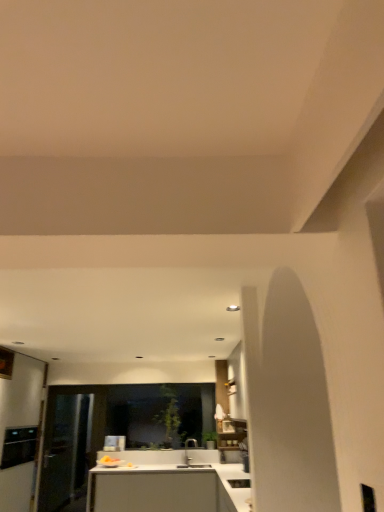
What do you see at coordinates (169, 489) in the screenshot? The height and width of the screenshot is (512, 384). I see `white glossy countertop at center` at bounding box center [169, 489].

The image size is (384, 512). Identify the location of transparent glass door at left. (65, 450).

Where is `black stainless steel oven at left, placed as the second appliance when sorted from right to left`? This screenshot has height=512, width=384. black stainless steel oven at left, placed as the second appliance when sorted from right to left is located at coordinates (19, 446).

Locate an element on the screen. This screenshot has width=384, height=512. white glossy sink at lower center, which appears as the second appliance when viewed from the back is located at coordinates (239, 483).

From the image's perspective, is matte silver faucet at center on top of white glossy sink at lower center, which is the second appliance in left-to-right order?

Incorrect, from the image's perspective, matte silver faucet at center is lower than white glossy sink at lower center, which is the second appliance in left-to-right order.

Are matte silver faucet at center and white glossy sink at lower center, which is the 1th appliance in front-to-back order, beside each other?

There is a gap between matte silver faucet at center and white glossy sink at lower center, which is the 1th appliance in front-to-back order.

Does matte silver faucet at center turn towards white glossy sink at lower center, arranged as the 1th appliance when viewed from the right?

No, matte silver faucet at center does not turn towards white glossy sink at lower center, arranged as the 1th appliance when viewed from the right.

Does matte silver faucet at center have a lesser width compared to white glossy sink at lower center, arranged as the 1th appliance when viewed from the right?

Yes, matte silver faucet at center is thinner than white glossy sink at lower center, arranged as the 1th appliance when viewed from the right.

Is transparent glass door at left outside of black stainless steel oven at left, which is the first appliance in back-to-front order?

Indeed, transparent glass door at left is completely outside black stainless steel oven at left, which is the first appliance in back-to-front order.

This screenshot has height=512, width=384. What are the coordinates of `glass door that is under the black stainless steel oven at left, placed as the second appliance when sorted from right to left (from a real-world perspective)` in the screenshot? It's located at 65,450.

From the image's perspective, would you say transparent glass door at left is shown under black stainless steel oven at left, which is the first appliance in back-to-front order?

Yes, from the image's perspective, transparent glass door at left is beneath black stainless steel oven at left, which is the first appliance in back-to-front order.

Where is `glass door located behind the matte silver faucet at center`? glass door located behind the matte silver faucet at center is located at coordinates (65, 450).

Considering the positions of objects transparent glass door at left and matte silver faucet at center in the image provided, who is behind, transparent glass door at left or matte silver faucet at center?

transparent glass door at left is further away from the camera.

Based on the photo, how different are the orientations of transparent glass door at left and matte silver faucet at center in degrees?

The facing directions of transparent glass door at left and matte silver faucet at center are 45 degrees apart.

Is transparent glass door at left inside the boundaries of matte silver faucet at center, or outside?

transparent glass door at left is outside matte silver faucet at center.

Considering the positions of objects white glossy countertop at center and transparent glass door at left in the image provided, who is more to the right, white glossy countertop at center or transparent glass door at left?

From the viewer's perspective, white glossy countertop at center appears more on the right side.

Are white glossy countertop at center and transparent glass door at left located far from each other?

white glossy countertop at center is positioned a significant distance from transparent glass door at left.

This screenshot has height=512, width=384. I want to click on countertop located in front of the transparent glass door at left, so point(169,489).

Considering their positions, is white glossy countertop at center located in front of or behind matte silver faucet at center?

white glossy countertop at center is in front of matte silver faucet at center.

Who is smaller, white glossy countertop at center or matte silver faucet at center?

With smaller size is matte silver faucet at center.

Considering the sizes of objects white glossy countertop at center and matte silver faucet at center in the image provided, who is thinner, white glossy countertop at center or matte silver faucet at center?

matte silver faucet at center.

Which is more to the left, white glossy countertop at center or matte silver faucet at center?

From the viewer's perspective, white glossy countertop at center appears more on the left side.

Considering the sizes of matte silver faucet at center and white glossy countertop at center in the image, is matte silver faucet at center bigger or smaller than white glossy countertop at center?

In the image, matte silver faucet at center appears to be smaller than white glossy countertop at center.

From a real-world perspective, is matte silver faucet at center positioned over white glossy countertop at center based on gravity?

Yes.

Based on the photo, considering the sizes of objects matte silver faucet at center and white glossy countertop at center in the image provided, who is wider, matte silver faucet at center or white glossy countertop at center?

With larger width is white glossy countertop at center.

Which of these two, white glossy countertop at center or black stainless steel oven at left, acting as the 1th appliance starting from the left, is bigger?

white glossy countertop at center is bigger.

Would you say black stainless steel oven at left, placed as the second appliance when sorted from right to left, is part of white glossy countertop at center's contents?

No, black stainless steel oven at left, placed as the second appliance when sorted from right to left, is located outside of white glossy countertop at center.

In the scene shown: From the image's perspective, is white glossy countertop at center located beneath black stainless steel oven at left, which is the first appliance in back-to-front order?

Correct, white glossy countertop at center appears lower than black stainless steel oven at left, which is the first appliance in back-to-front order, in the image.

Which of these two, white glossy countertop at center or black stainless steel oven at left, which is the first appliance in back-to-front order, is wider?

Wider between the two is white glossy countertop at center.

The image size is (384, 512). I want to click on tap positioned vertically above the white glossy sink at lower center, which is the second appliance in left-to-right order (from a real-world perspective), so click(x=187, y=449).

Locate an element on the screen. glass door lying on the right of black stainless steel oven at left, acting as the 1th appliance starting from the left is located at coordinates (65, 450).

From the image, which object appears to be nearer to black stainless steel oven at left, the second appliance when ordered from front to back, matte silver faucet at center or transparent glass door at left?

The object closer to black stainless steel oven at left, the second appliance when ordered from front to back, is transparent glass door at left.

Looking at this image, which object lies nearer to the anchor point matte silver faucet at center, black stainless steel oven at left, which is the first appliance in back-to-front order, or white glossy sink at lower center, which is the second appliance in left-to-right order?

white glossy sink at lower center, which is the second appliance in left-to-right order.

When comparing their distances from matte silver faucet at center, does white glossy sink at lower center, arranged as the 1th appliance when viewed from the right, or black stainless steel oven at left, the second appliance when ordered from front to back, seem closer?

Based on the image, white glossy sink at lower center, arranged as the 1th appliance when viewed from the right, appears to be nearer to matte silver faucet at center.

Looking at the image, which one is located closer to transparent glass door at left, white glossy countertop at center or black stainless steel oven at left, the second appliance when ordered from front to back?

Among the two, black stainless steel oven at left, the second appliance when ordered from front to back, is located nearer to transparent glass door at left.

Based on their spatial positions, is white glossy sink at lower center, which appears as the second appliance when viewed from the back, or white glossy countertop at center further from transparent glass door at left?

The object further to transparent glass door at left is white glossy sink at lower center, which appears as the second appliance when viewed from the back.

Based on their spatial positions, is matte silver faucet at center or white glossy sink at lower center, which is the 1th appliance in front-to-back order, further from black stainless steel oven at left, the second appliance when ordered from front to back?

Among the two, white glossy sink at lower center, which is the 1th appliance in front-to-back order, is located further to black stainless steel oven at left, the second appliance when ordered from front to back.

Looking at the image, which one is located closer to black stainless steel oven at left, acting as the 1th appliance starting from the left, white glossy countertop at center or matte silver faucet at center?

Among the two, white glossy countertop at center is located nearer to black stainless steel oven at left, acting as the 1th appliance starting from the left.

Estimate the real-world distances between objects in this image. Which object is closer to transparent glass door at left, matte silver faucet at center or black stainless steel oven at left, acting as the 1th appliance starting from the left?

black stainless steel oven at left, acting as the 1th appliance starting from the left, lies closer to transparent glass door at left than the other object.

In order to click on countertop between black stainless steel oven at left, acting as the 1th appliance starting from the left, and matte silver faucet at center, in the horizontal direction in this screenshot , I will do `click(169, 489)`.

Image resolution: width=384 pixels, height=512 pixels. I want to click on tap between black stainless steel oven at left, which is the first appliance in back-to-front order, and white glossy sink at lower center, which is the second appliance in left-to-right order, in the horizontal direction, so click(x=187, y=449).

Locate an element on the screen. The height and width of the screenshot is (512, 384). glass door between black stainless steel oven at left, placed as the second appliance when sorted from right to left, and white glossy sink at lower center, which is the 1th appliance in front-to-back order, in the horizontal direction is located at coordinates (65, 450).

In order to click on countertop between white glossy sink at lower center, which is the 1th appliance in front-to-back order, and matte silver faucet at center in the front-back direction in this screenshot , I will do `click(169, 489)`.